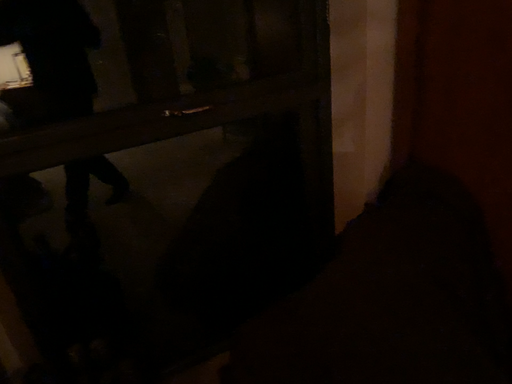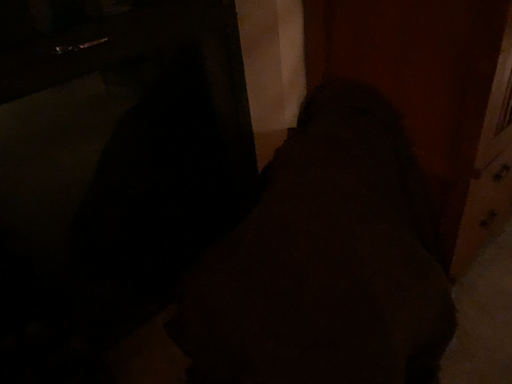
Question: Which way did the camera rotate in the video?

Choices:
 (A) rotated left
 (B) rotated right

Answer: (B)